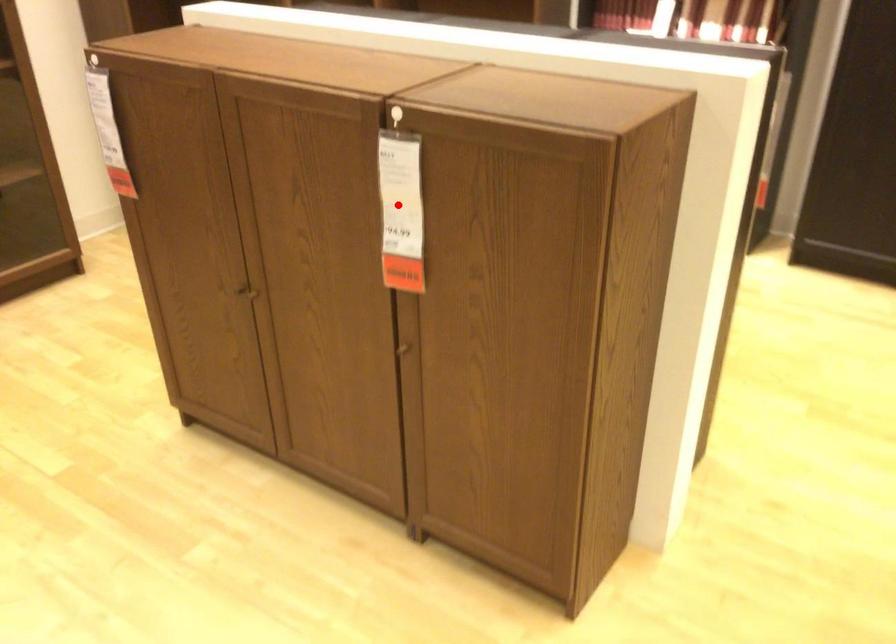
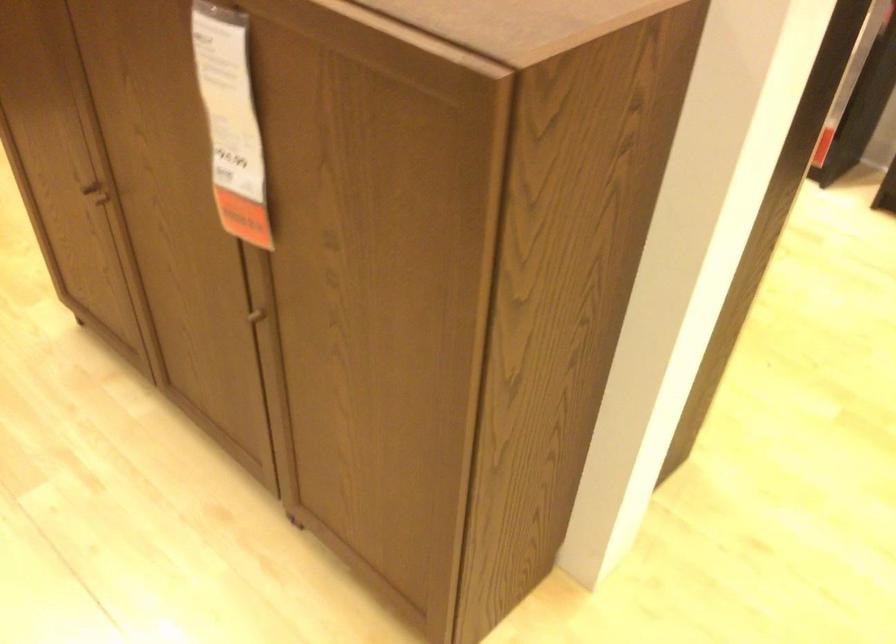
In the second image, find the point that corresponds to the highlighted location in the first image.

(230, 122)